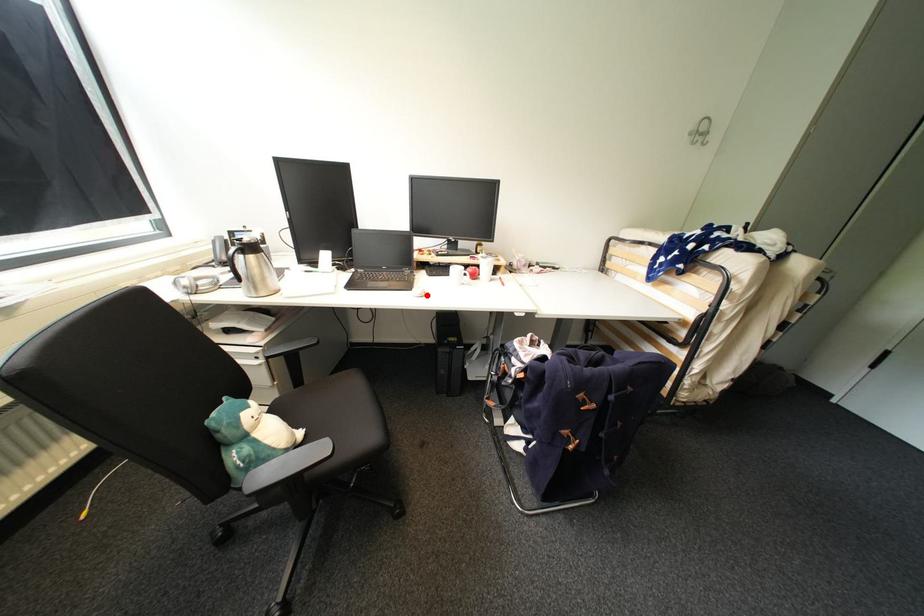
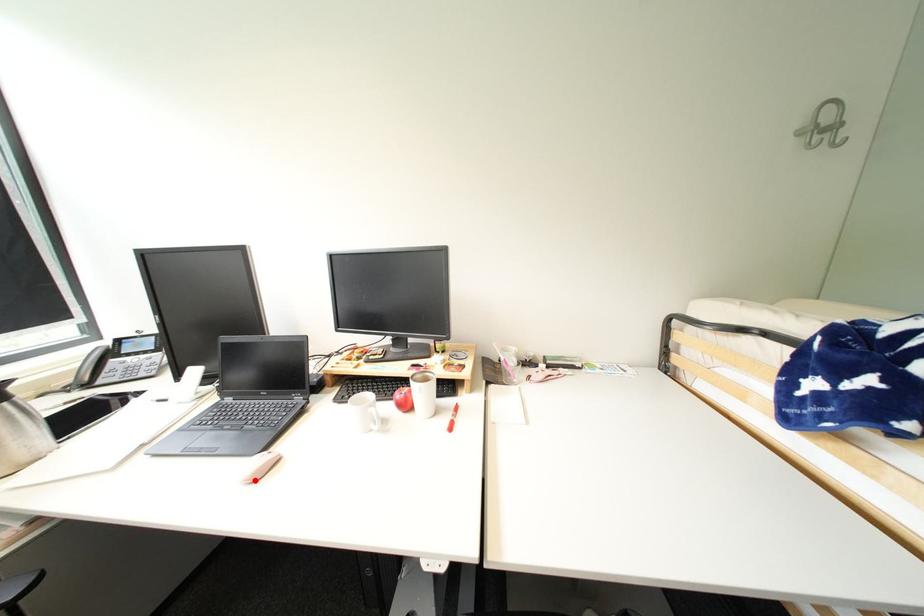
I am providing you with two images of the same scene from different viewpoints. A red point is marked on the first image and another point is marked on the second image. Is the red point in image1 aligned with the point shown in image2?

Yes